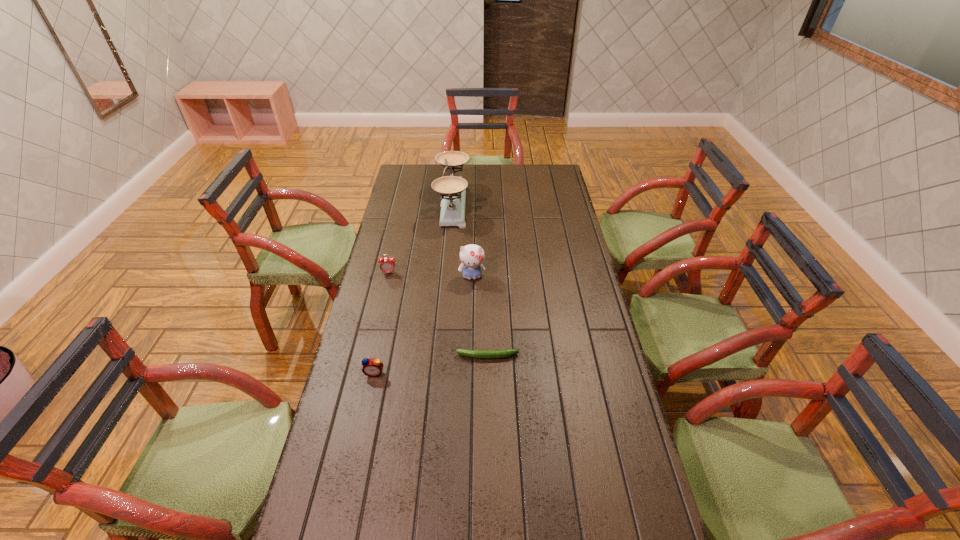
I want to click on vacant space that satisfies the following two spatial constraints: 1. on the front-facing side of the shortest object; 2. on the front-facing side of the nearest object, so click(488, 373).

Image resolution: width=960 pixels, height=540 pixels. What are the coordinates of `vacant space that satisfies the following two spatial constraints: 1. on the front-facing side of the farthest object; 2. on the front-facing side of the nearer alarm clock` in the screenshot? It's located at (439, 373).

You are a GUI agent. You are given a task and a screenshot of the screen. Output one action in this format:
    pyautogui.click(x=<x>, y=<y>)
    Task: Click on the vacant space that satisfies the following two spatial constraints: 1. on the front-facing side of the tallest object; 2. on the face of the farther alarm clock
    
    Given the screenshot: What is the action you would take?
    point(447,273)